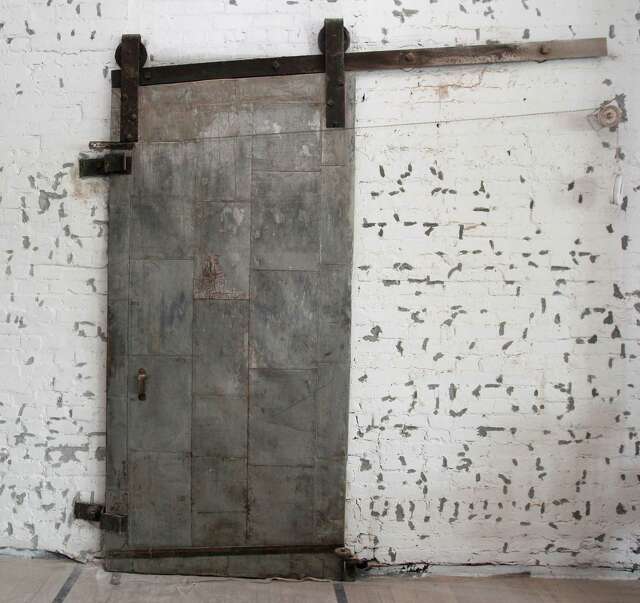
What are the coordinates of `white paint` in the screenshot? It's located at (59, 120).